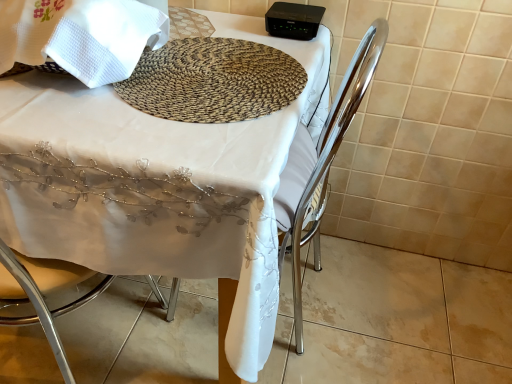
The width and height of the screenshot is (512, 384). Find the location of `vacant space situated above woven natural fiber mat at center (from a real-world perspective)`. vacant space situated above woven natural fiber mat at center (from a real-world perspective) is located at coordinates (218, 74).